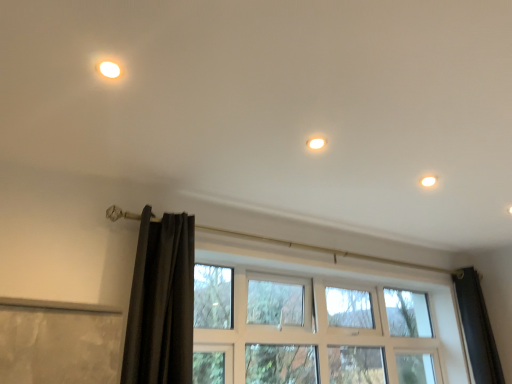
Question: Would you say clear glass window at center contains white glossy light fixture at upper right?

Choices:
 (A) yes
 (B) no

Answer: (B)

Question: Is clear glass window at center with white glossy light fixture at upper right?

Choices:
 (A) yes
 (B) no

Answer: (B)

Question: From a real-world perspective, is clear glass window at center located higher than white glossy light fixture at upper right?

Choices:
 (A) no
 (B) yes

Answer: (A)

Question: Considering the relative sizes of clear glass window at center and white glossy light fixture at upper right in the image provided, is clear glass window at center taller than white glossy light fixture at upper right?

Choices:
 (A) no
 (B) yes

Answer: (B)

Question: Is clear glass window at center to the left of white glossy light fixture at upper right from the viewer's perspective?

Choices:
 (A) yes
 (B) no

Answer: (A)

Question: Does clear glass window at center have a smaller size compared to white glossy light fixture at upper right?

Choices:
 (A) no
 (B) yes

Answer: (A)

Question: Can you confirm if white glossy light fixture at upper right is taller than matte white light at upper left?

Choices:
 (A) no
 (B) yes

Answer: (B)

Question: Could you tell me if white glossy light fixture at upper right is facing matte white light at upper left?

Choices:
 (A) yes
 (B) no

Answer: (B)

Question: Does white glossy light fixture at upper right have a larger size compared to matte white light at upper left?

Choices:
 (A) yes
 (B) no

Answer: (B)

Question: Is the position of white glossy light fixture at upper right less distant than that of matte white light at upper left?

Choices:
 (A) no
 (B) yes

Answer: (A)

Question: From the image's perspective, is white glossy light fixture at upper right under matte white light at upper left?

Choices:
 (A) no
 (B) yes

Answer: (B)

Question: From the image's perspective, does white glossy light fixture at upper right appear higher than matte white light at upper left?

Choices:
 (A) no
 (B) yes

Answer: (A)

Question: From a real-world perspective, does black velvet curtain at left stand above matte white light at upper left?

Choices:
 (A) yes
 (B) no

Answer: (B)